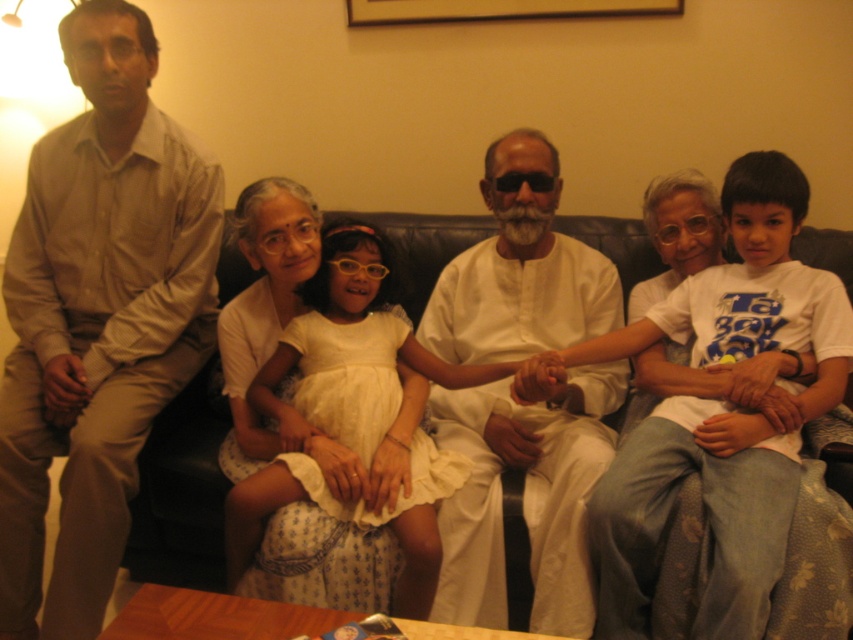
Does point (19, 468) lie behind point (608, 573)?

Yes.

Can you confirm if matte beige shirt at left is positioned to the left of white cotton shirt at center?

Correct, you'll find matte beige shirt at left to the left of white cotton shirt at center.

This screenshot has height=640, width=853. I want to click on matte beige shirt at left, so click(x=97, y=317).

Is white cotton shirt at center to the right of black leather couch at center from the viewer's perspective?

Correct, you'll find white cotton shirt at center to the right of black leather couch at center.

Does white cotton shirt at center appear under black leather couch at center?

No, white cotton shirt at center is not below black leather couch at center.

I want to click on white cotton shirt at center, so coord(706,513).

Can you confirm if black leather couch at center is taller than white cotton dress at center?

In fact, black leather couch at center may be shorter than white cotton dress at center.

Identify the location of black leather couch at center. (183, 490).

This screenshot has height=640, width=853. In order to click on black leather couch at center in this screenshot , I will do `click(183, 490)`.